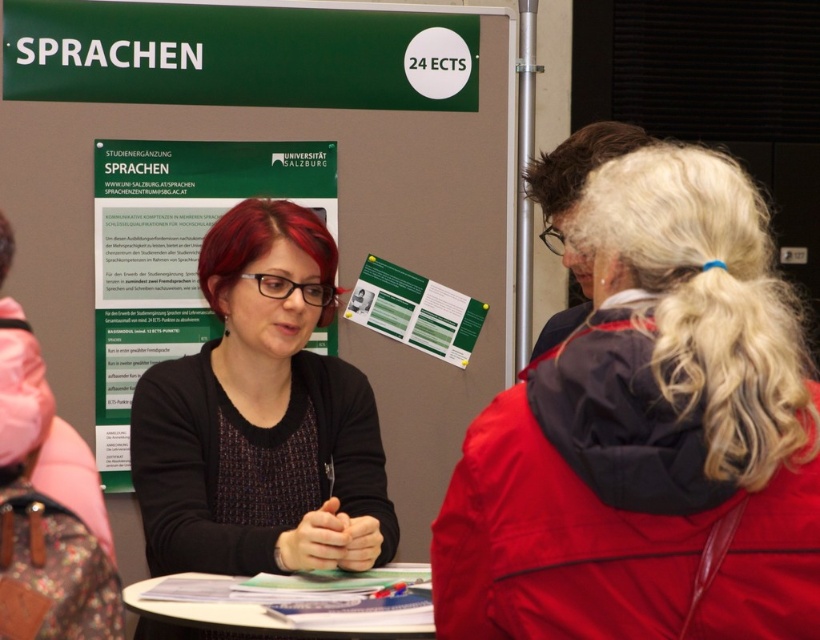
What are the coordinates of the green cardboard poster at center?

The green cardboard poster at center is located at coordinates point [247,196].

You are standing at the booth and want to read the green cardboard poster at center. However, there is a person wearing a dark blue jacket at center blocking your view. Can you see the poster clearly?

The green cardboard poster at center is further to the viewer than dark blue jacket at center, so the poster is behind the person in the dark blue jacket at center. Therefore, the dark blue jacket at center is blocking your view of the green cardboard poster at center, making it difficult to see clearly.